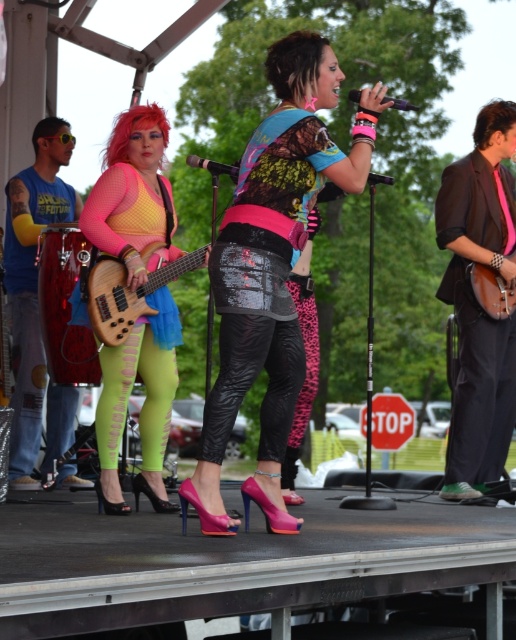
Between point (124, 349) and point (489, 122), which one is positioned behind?

The point (489, 122) is behind.

In the scene shown: Does neon green mesh top at center have a larger size compared to shiny brown guitar at right?

No, neon green mesh top at center is not bigger than shiny brown guitar at right.

Does point (137, 337) come in front of point (488, 163)?

Yes, point (137, 337) is closer to viewer.

This screenshot has width=516, height=640. Identify the location of neon green mesh top at center. (142, 404).

Consider the image. Is shiny brown guitar at right closer to camera compared to brushed metal drum at left?

No, it is not.

Is point (459, 272) positioned behind point (7, 232)?

No, it is in front of (7, 232).

Identify the location of shiny brown guitar at right. The width and height of the screenshot is (516, 640). (475, 304).

Who is more forward, (303,40) or (116,259)?

Point (303,40)

Is shiny sequined skirt at center shorter than wooden bass guitar at center?

No.

You are a GUI agent. You are given a task and a screenshot of the screen. Output one action in this format:
    pyautogui.click(x=<x>, y=<y>)
    Task: Click on the shiny sequined skirt at center
    The height and width of the screenshot is (640, 516).
    Given the screenshot: What is the action you would take?
    pyautogui.click(x=272, y=269)